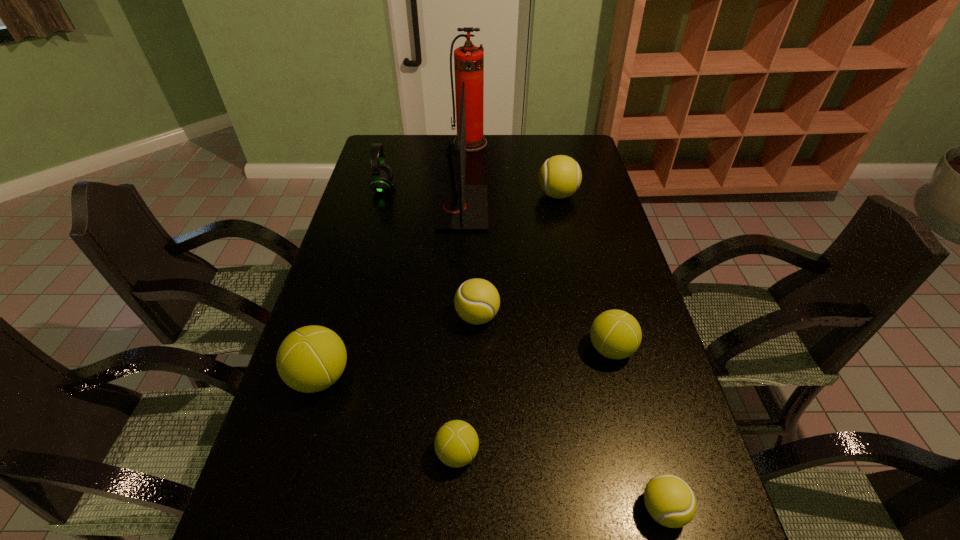
You are a GUI agent. You are given a task and a screenshot of the screen. Output one action in this format:
    pyautogui.click(x=<x>, y=<y>)
    Task: Click on the free spot that satisfies the following two spatial constraints: 1. at the discharge end of the smallest yellow tennis ball; 2. on the right side of the tallest object
    This screenshot has height=540, width=960.
    Given the screenshot: What is the action you would take?
    pyautogui.click(x=458, y=509)

Where is `free spot that satisfies the following two spatial constraints: 1. on the screen side of the nearest object; 2. on the left side of the second tallest object`? free spot that satisfies the following two spatial constraints: 1. on the screen side of the nearest object; 2. on the left side of the second tallest object is located at coordinates (445, 509).

The width and height of the screenshot is (960, 540). I want to click on free space that satisfies the following two spatial constraints: 1. at the discharge end of the leftmost yellow tennis ball; 2. on the right side of the farthest object, so click(x=465, y=316).

Find the location of a particular element. This screenshot has width=960, height=540. free space that satisfies the following two spatial constraints: 1. on the front side of the leftmost yellow tennis ball; 2. on the right side of the rightmost green tennis ball is located at coordinates (477, 349).

The image size is (960, 540). Identify the location of vacant space that satisfies the following two spatial constraints: 1. on the front side of the farthest tennis ball; 2. on the screen side of the monitor. (561, 208).